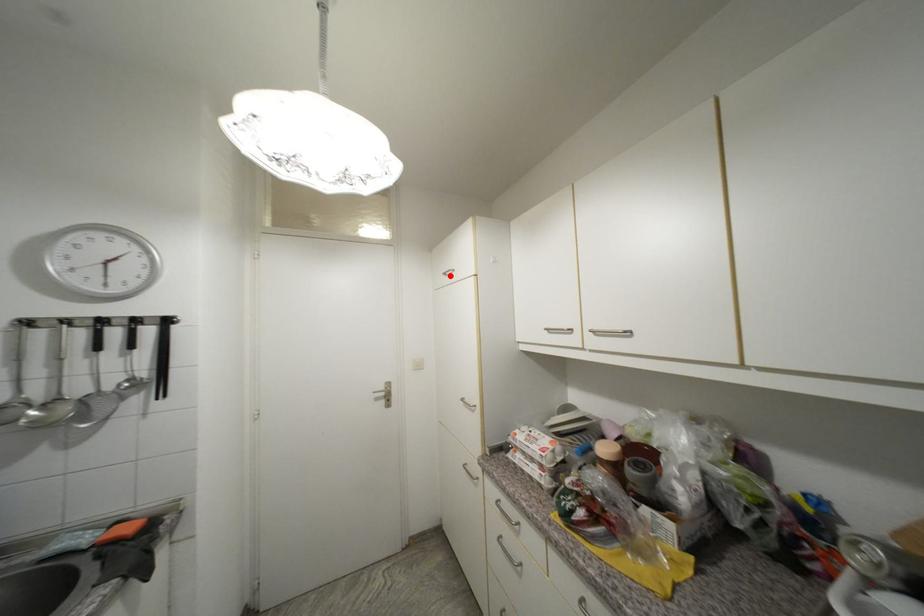
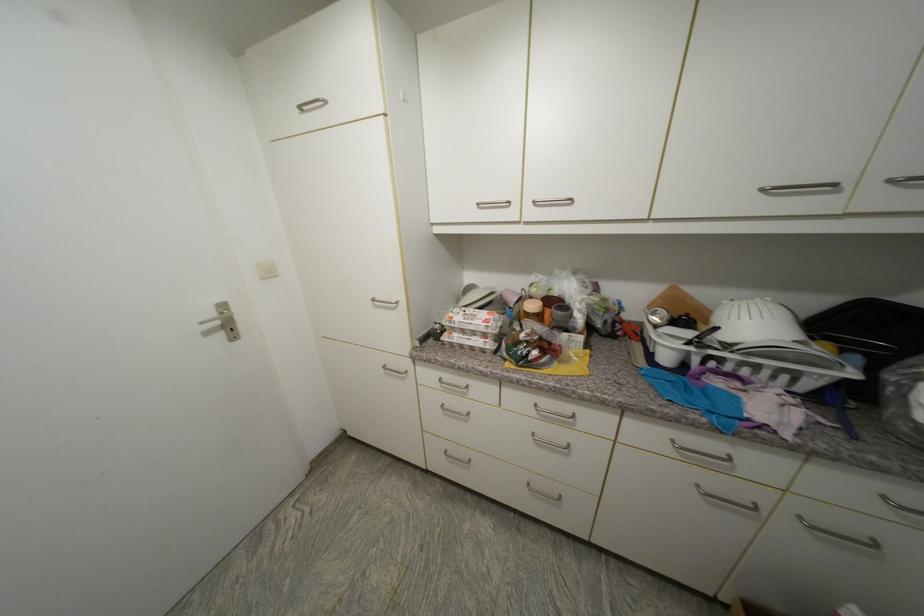
In the second image, find the point that corresponds to the highlighted location in the first image.

(307, 108)